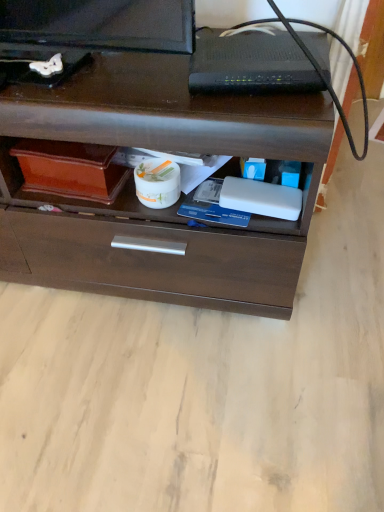
Question: From their relative heights in the image, would you say brown wood chest of drawers at center is taller or shorter than black plastic router at upper center?

Choices:
 (A) tall
 (B) short

Answer: (A)

Question: From the image's perspective, is brown wood chest of drawers at center positioned above or below black plastic router at upper center?

Choices:
 (A) above
 (B) below

Answer: (B)

Question: Looking at the image, does brown wood chest of drawers at center seem bigger or smaller compared to black plastic router at upper center?

Choices:
 (A) big
 (B) small

Answer: (A)

Question: From the image's perspective, is black plastic router at upper center above or below brown wood chest of drawers at center?

Choices:
 (A) below
 (B) above

Answer: (B)

Question: In the image, is black plastic router at upper center on the left side or the right side of brown wood chest of drawers at center?

Choices:
 (A) left
 (B) right

Answer: (B)

Question: Relative to brown wood chest of drawers at center, is black plastic router at upper center in front or behind?

Choices:
 (A) behind
 (B) front

Answer: (A)

Question: Is black plastic router at upper center wider or thinner than brown wood chest of drawers at center?

Choices:
 (A) wide
 (B) thin

Answer: (B)